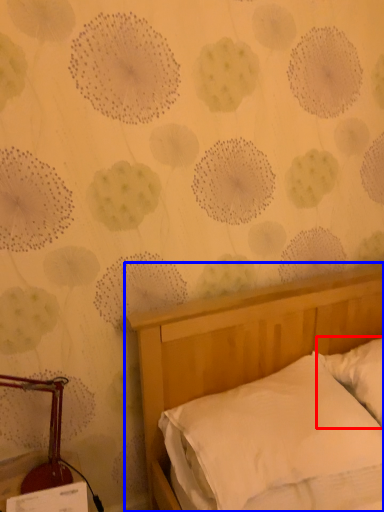
Question: Among these objects, which one is nearest to the camera, pillow (highlighted by a red box) or bed (highlighted by a blue box)?

Choices:
 (A) pillow
 (B) bed

Answer: (B)